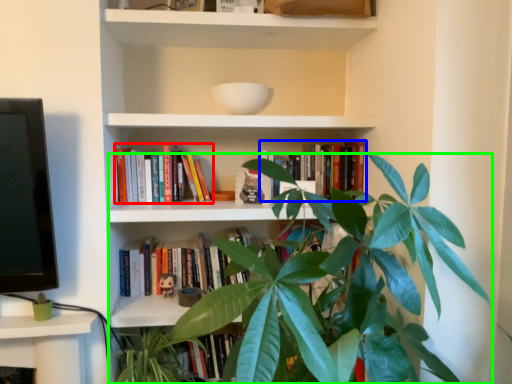
Question: Considering the real-world distances, which object is closest to book (highlighted by a red box)? book (highlighted by a blue box) or houseplant (highlighted by a green box).

Choices:
 (A) book
 (B) houseplant

Answer: (A)